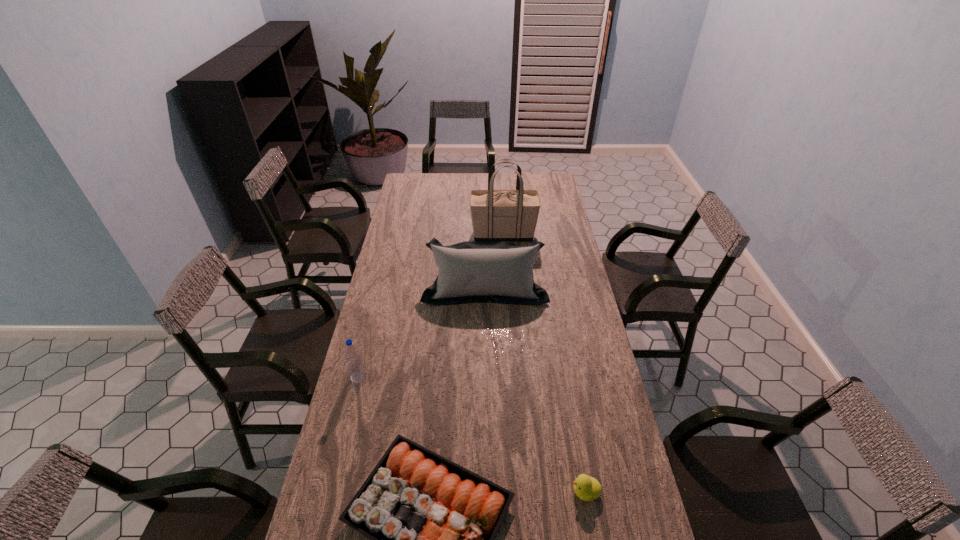
This screenshot has width=960, height=540. Find the location of `blank space at the far left corner of the desktop`. blank space at the far left corner of the desktop is located at coordinates (429, 176).

Find the location of a particular element. This screenshot has height=540, width=960. free spot between the water bottle and the duckling is located at coordinates click(472, 434).

The height and width of the screenshot is (540, 960). Find the location of `unoccupied position between the duckling and the farthest object`. unoccupied position between the duckling and the farthest object is located at coordinates (544, 363).

Find the location of a particular element. vacant point located between the duckling and the cushion is located at coordinates (536, 390).

Identify the location of vacant region between the fourth tallest object and the shopping bag. (544, 363).

Where is `the second closest object to the platter`? This screenshot has height=540, width=960. the second closest object to the platter is located at coordinates (355, 365).

Select which object appears as the third closest to the leftmost object. Please provide its 2D coordinates. Your answer should be formatted as a tuple, i.e. [(x, y)], where the tuple contains the x and y coordinates of a point satisfying the conditions above.

[(587, 488)]

In order to click on free space that satisfies the following two spatial constraints: 1. with handles facing forward on the farthest object; 2. on the surface of the cushion in this screenshot , I will do `click(507, 289)`.